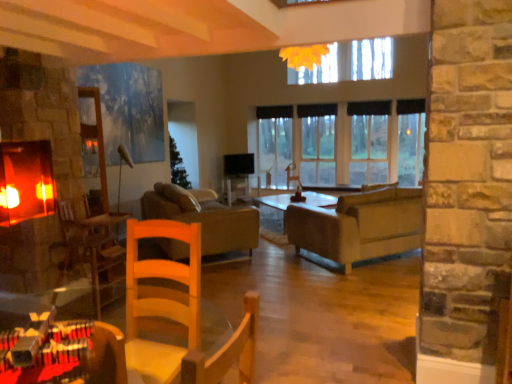
Question: Does wooden table at lower left lie in front of wooden armchair at left?

Choices:
 (A) no
 (B) yes

Answer: (B)

Question: Is wooden table at lower left placed right next to wooden armchair at left?

Choices:
 (A) yes
 (B) no

Answer: (B)

Question: Considering the relative positions of wooden table at lower left and wooden armchair at left in the image provided, is wooden table at lower left to the left of wooden armchair at left from the viewer's perspective?

Choices:
 (A) yes
 (B) no

Answer: (B)

Question: From the image's perspective, does wooden table at lower left appear higher than wooden armchair at left?

Choices:
 (A) no
 (B) yes

Answer: (B)

Question: Is wooden table at lower left not inside wooden armchair at left?

Choices:
 (A) yes
 (B) no

Answer: (A)

Question: Do you think matte gray couch at center, the 2th studio couch positioned from the left, is within brown leather couch at center, the 1th studio couch in the left-to-right sequence, or outside of it?

Choices:
 (A) inside
 (B) outside

Answer: (B)

Question: Visually, is matte gray couch at center, the 2th studio couch positioned from the left, positioned to the left or to the right of brown leather couch at center, the second studio couch positioned from the right?

Choices:
 (A) left
 (B) right

Answer: (B)

Question: In terms of width, does matte gray couch at center, the 2th studio couch positioned from the left, look wider or thinner when compared to brown leather couch at center, the second studio couch positioned from the right?

Choices:
 (A) thin
 (B) wide

Answer: (B)

Question: From the image's perspective, is matte gray couch at center, which is counted as the first studio couch, starting from the right, above or below brown leather couch at center, the second studio couch positioned from the right?

Choices:
 (A) below
 (B) above

Answer: (B)

Question: Is clear glass window at center situated inside brown leather couch at center, the second studio couch positioned from the right, or outside?

Choices:
 (A) inside
 (B) outside

Answer: (B)

Question: Relative to brown leather couch at center, the 1th studio couch in the left-to-right sequence, is clear glass window at center in front or behind?

Choices:
 (A) front
 (B) behind

Answer: (B)

Question: In terms of width, does clear glass window at center look wider or thinner when compared to brown leather couch at center, the second studio couch positioned from the right?

Choices:
 (A) wide
 (B) thin

Answer: (B)

Question: From a real-world perspective, is clear glass window at center above or below brown leather couch at center, the second studio couch positioned from the right?

Choices:
 (A) below
 (B) above

Answer: (B)

Question: Is point (208, 221) closer or farther from the camera than point (368, 157)?

Choices:
 (A) closer
 (B) farther

Answer: (A)

Question: Visually, is brown leather couch at center, the 1th studio couch in the left-to-right sequence, positioned to the left or to the right of clear glass window at center?

Choices:
 (A) right
 (B) left

Answer: (B)